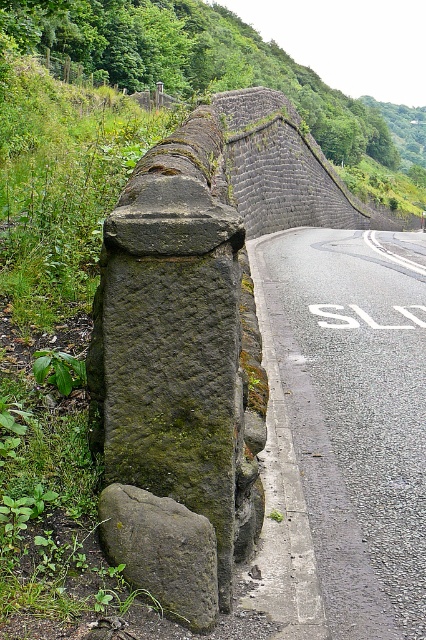
You are standing at the origin point of the image. Where is the asphalt road at center located in terms of its 2D coordinates?

The asphalt road at center is located at the 2D coordinates of point (354, 420).